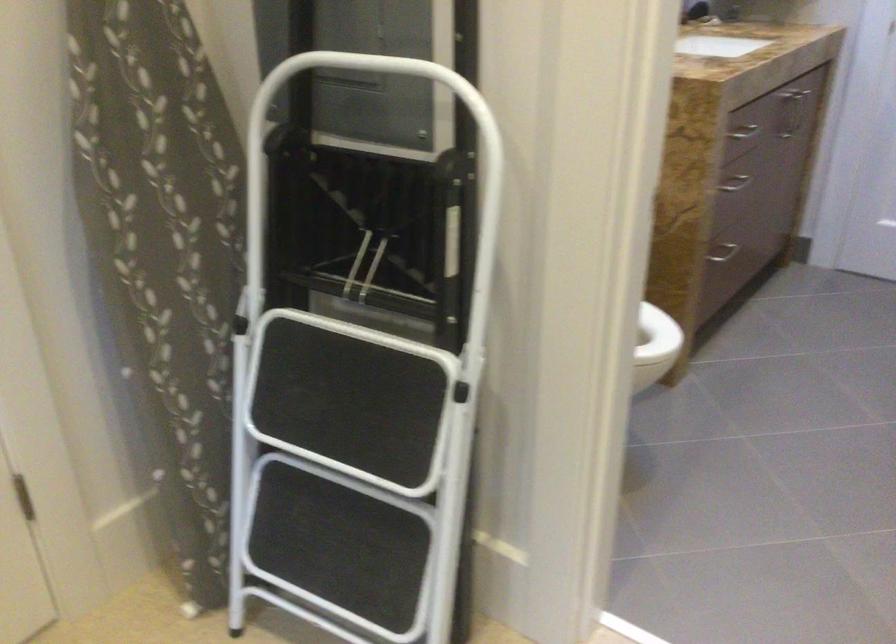
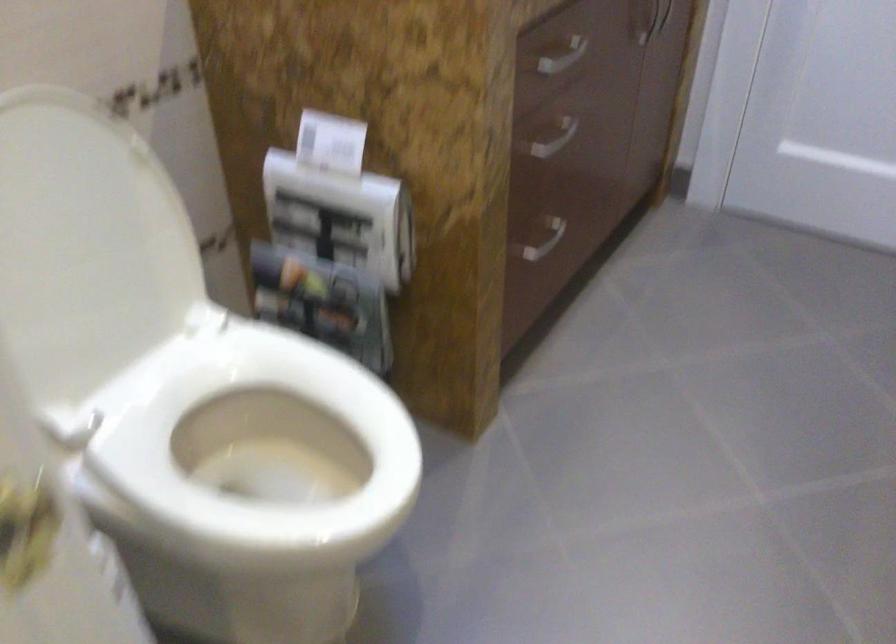
Where in the second image is the point corresponding to (x=742, y=138) from the first image?

(562, 57)